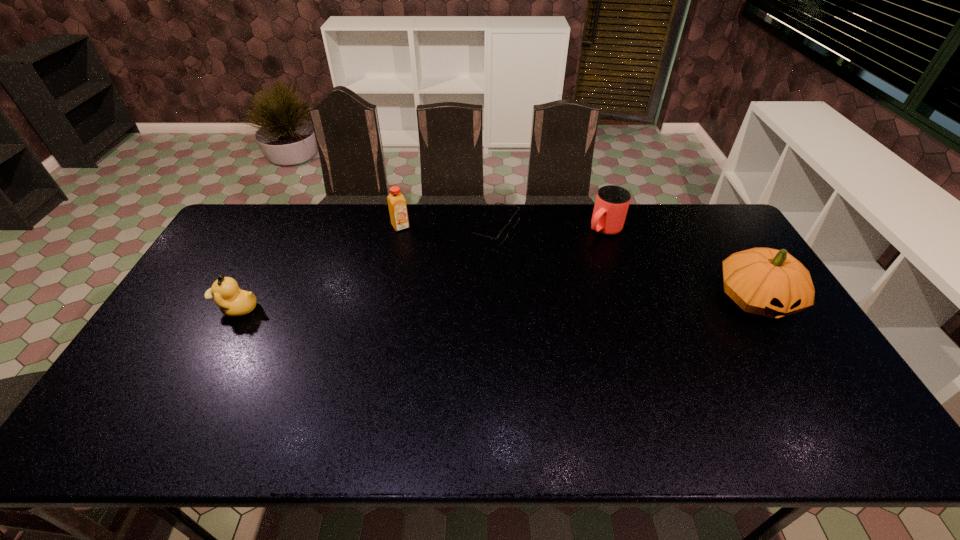
At what (x,y) coordinates should I click in order to perform the action: click on the leftmost object. Please return your answer as a coordinate pair (x, y). The image size is (960, 540). Looking at the image, I should click on (233, 302).

Where is `gourd`? The width and height of the screenshot is (960, 540). gourd is located at coordinates (764, 281).

Find the location of `the tallest object`. the tallest object is located at coordinates (764, 281).

I want to click on the shortest object, so click(503, 234).

You are a GUI agent. You are given a task and a screenshot of the screen. Output one action in this format:
    pyautogui.click(x=<x>, y=<y>)
    Task: Click on the spectacles
    This screenshot has height=540, width=960.
    Given the screenshot: What is the action you would take?
    pyautogui.click(x=503, y=234)

Locate an element on the screen. orange juice is located at coordinates (397, 205).

Where is `cup`? cup is located at coordinates (612, 202).

Identify the location of free space located 0.100m on the face of the leftmost object. (180, 308).

I want to click on vacant region located 0.090m on the face of the leftmost object, so click(183, 308).

Where is `free point located on the side of the gourd with the carved face`? The width and height of the screenshot is (960, 540). free point located on the side of the gourd with the carved face is located at coordinates coord(806,383).